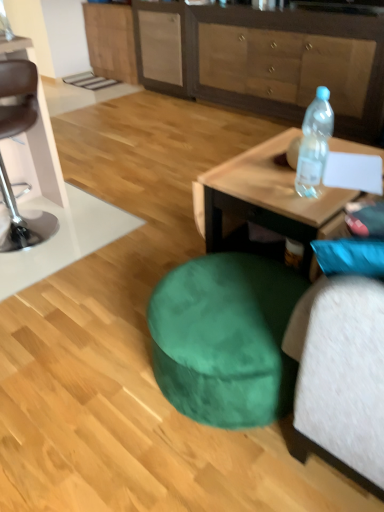
This screenshot has width=384, height=512. Find the location of `vacant space in front of velvet green bean bag at lower center`. vacant space in front of velvet green bean bag at lower center is located at coordinates (210, 472).